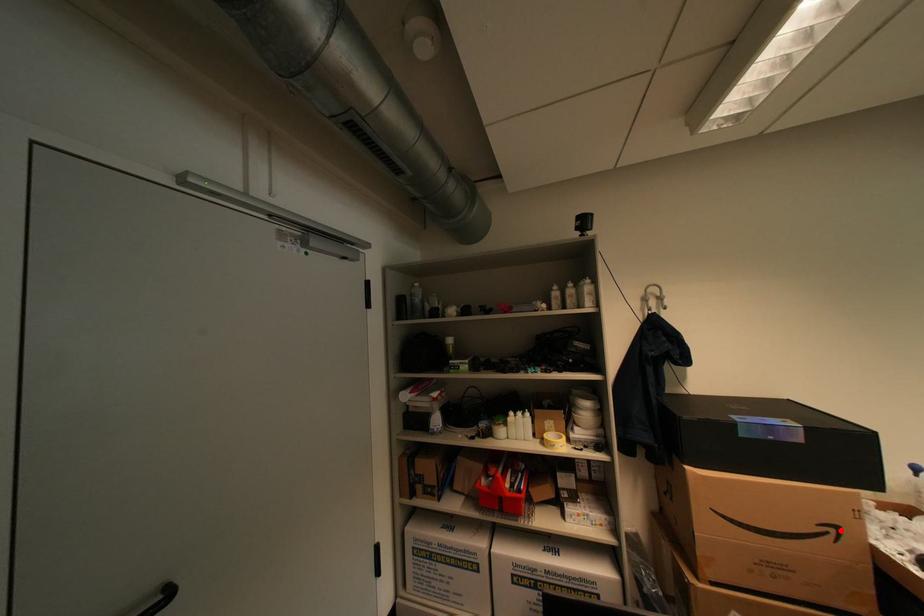
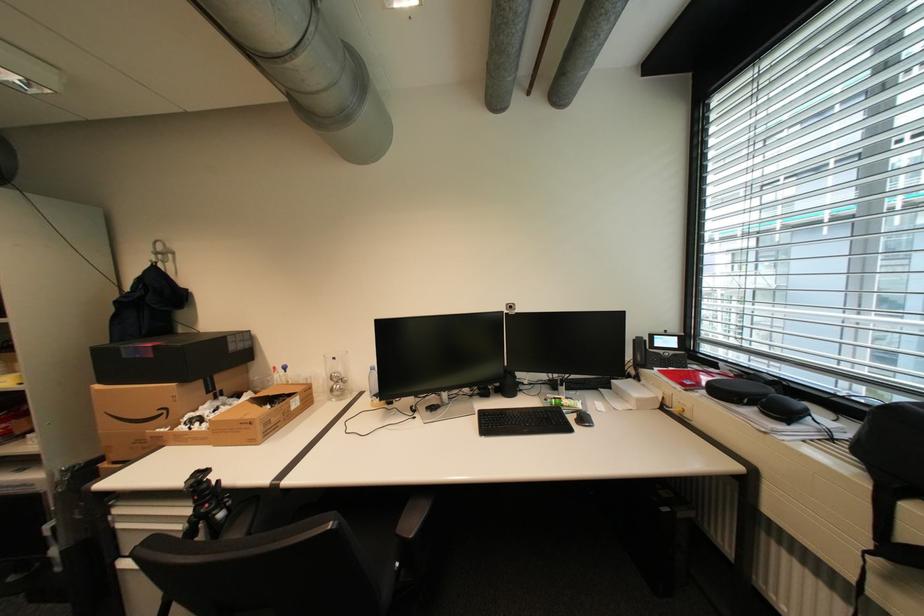
Where in the second image is the point corresponding to the highlighted location from the first image?

(174, 411)